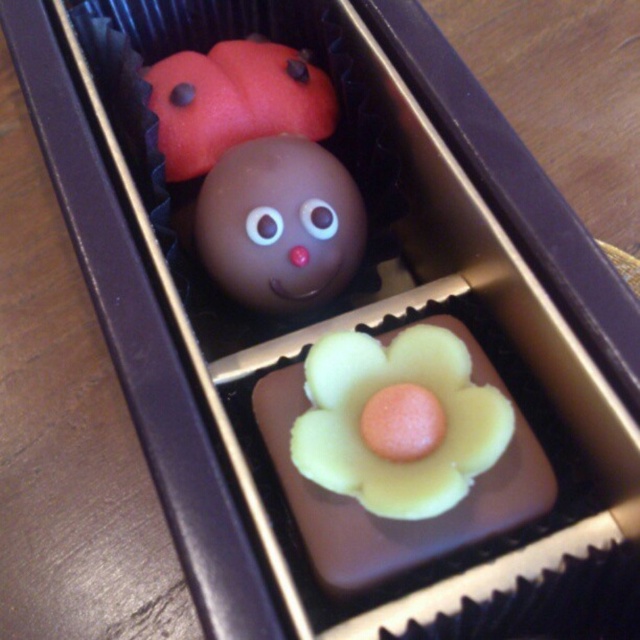
Is point (333, 224) less distant than point (220, 61)?

That is True.

Which is above, matte chocolate ball at center or matte chocolate ladybug at upper left?

matte chocolate ladybug at upper left is higher up.

This screenshot has width=640, height=640. Identify the location of matte chocolate ball at center. (280, 225).

Is yellow matte flower at center above matte chocolate ladybug at upper left?

Actually, yellow matte flower at center is below matte chocolate ladybug at upper left.

Does yellow matte flower at center appear on the right side of matte chocolate ladybug at upper left?

Indeed, yellow matte flower at center is positioned on the right side of matte chocolate ladybug at upper left.

You are a GUI agent. You are given a task and a screenshot of the screen. Output one action in this format:
    pyautogui.click(x=<x>, y=<y>)
    Task: Click on the yellow matte flower at center
    This screenshot has width=640, height=640.
    Given the screenshot: What is the action you would take?
    pyautogui.click(x=364, y=406)

Identify the location of yellow matte flower at center. pos(364,406).

Can you confirm if yellow matte flower at center is smaller than matte chocolate ball at center?

Incorrect, yellow matte flower at center is not smaller in size than matte chocolate ball at center.

Can you confirm if yellow matte flower at center is positioned below matte chocolate ball at center?

Yes.

Which is behind, point (397, 369) or point (220, 253)?

Positioned behind is point (220, 253).

Find the location of a particular element. yellow matte flower at center is located at coordinates (364, 406).